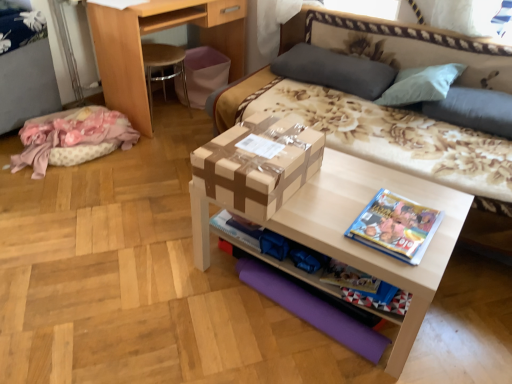
Locate an element on the screen. This screenshot has width=512, height=384. vacant region to the left of matte cardboard box at center is located at coordinates (152, 280).